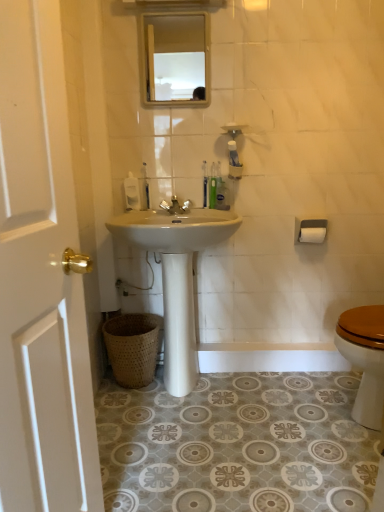
Where is `white matte toilet paper at right`? The height and width of the screenshot is (512, 384). white matte toilet paper at right is located at coordinates (312, 234).

The width and height of the screenshot is (384, 512). Describe the element at coordinates (175, 58) in the screenshot. I see `clear glass mirror at upper center` at that location.

Measure the distance between green plastic toothbrush at upper center, placed as the 1th toothbrush when sorted from right to left, and camera.

The depth of green plastic toothbrush at upper center, placed as the 1th toothbrush when sorted from right to left, is 6.64 feet.

At what (x,y) coordinates should I click in order to perform the action: click on translucent plastic toothbrush at center, which appears as the 2th toothbrush when viewed from the right. Please return your answer as a coordinate pair (x, y). Image resolution: width=384 pixels, height=512 pixels. Looking at the image, I should click on (205, 185).

Based on the photo, is translucent plastic toothbrush at center, which appears as the 2th toothbrush when viewed from the right, to the left of translucent plastic toothbrushes at upper center, the 1th toiletries positioned from the right, from the viewer's perspective?

Indeed, translucent plastic toothbrush at center, which appears as the 2th toothbrush when viewed from the right, is positioned on the left side of translucent plastic toothbrushes at upper center, the 1th toiletries positioned from the right.

Is translucent plastic toothbrushes at upper center, the 1th toiletries positioned from the right, completely or partially inside translucent plastic toothbrush at center, the 2th toothbrush viewed from the left?

That's incorrect, translucent plastic toothbrushes at upper center, the 1th toiletries positioned from the right, is not inside translucent plastic toothbrush at center, the 2th toothbrush viewed from the left.

Is translucent plastic toothbrush at center, the 2th toothbrush viewed from the left, wider or thinner than translucent plastic toothbrushes at upper center, the 1th toiletries positioned from the right?

Clearly, translucent plastic toothbrush at center, the 2th toothbrush viewed from the left, has less width compared to translucent plastic toothbrushes at upper center, the 1th toiletries positioned from the right.

From the image's perspective, between translucent plastic toothbrush at center, which appears as the 2th toothbrush when viewed from the right, and translucent plastic toothbrushes at upper center, the 2th toiletries from the left, which one is located above?

translucent plastic toothbrush at center, which appears as the 2th toothbrush when viewed from the right, from the image's perspective.

Is translucent plastic toothbrushes at upper center, the 1th toiletries positioned from the right, next to translucent plastic toothbrush at center, which appears as the 2th toothbrush when viewed from the right?

Yes, the surface of translucent plastic toothbrushes at upper center, the 1th toiletries positioned from the right, is in contact with translucent plastic toothbrush at center, which appears as the 2th toothbrush when viewed from the right.

How much distance is there between translucent plastic toothbrushes at upper center, the 2th toiletries from the left, and translucent plastic toothbrush at center, the 2th toothbrush viewed from the left?

translucent plastic toothbrushes at upper center, the 2th toiletries from the left, is 3.04 inches from translucent plastic toothbrush at center, the 2th toothbrush viewed from the left.

Consider the image. Is translucent plastic toothbrushes at upper center, the 1th toiletries positioned from the right, in front of or behind translucent plastic toothbrush at center, which appears as the 2th toothbrush when viewed from the right, in the image?

In the image, translucent plastic toothbrushes at upper center, the 1th toiletries positioned from the right, appears in front of translucent plastic toothbrush at center, which appears as the 2th toothbrush when viewed from the right.

From the image's perspective, between translucent plastic toothbrushes at upper center, the 2th toiletries from the left, and translucent plastic toothbrush at center, the 2th toothbrush viewed from the left, who is located below?

translucent plastic toothbrushes at upper center, the 2th toiletries from the left, is shown below in the image.

In the scene shown: Which object is positioned more to the left, translucent plastic toothbrush at center, the 2th toothbrush viewed from the left, or translucent plastic toothbrush at center, which appears as the 1th toothbrush when viewed from the left?

Positioned to the left is translucent plastic toothbrush at center, which appears as the 1th toothbrush when viewed from the left.

Is translucent plastic toothbrush at center, the 2th toothbrush viewed from the left, shorter than translucent plastic toothbrush at center, which appears as the 1th toothbrush when viewed from the left?

In fact, translucent plastic toothbrush at center, the 2th toothbrush viewed from the left, may be taller than translucent plastic toothbrush at center, which appears as the 1th toothbrush when viewed from the left.

From the image's perspective, between translucent plastic toothbrush at center, the 2th toothbrush viewed from the left, and translucent plastic toothbrush at center, placed as the 3th toothbrush when sorted from right to left, which one is located above?

From the image's view, translucent plastic toothbrush at center, the 2th toothbrush viewed from the left, is above.

Considering the positions of points (207, 199) and (147, 183), is point (207, 199) farther from camera compared to point (147, 183)?

That is False.

Considering the sizes of objects translucent plastic soap dispenser at upper center, which is the 2th toiletries in right-to-left order, and white glossy sink at center in the image provided, who is smaller, translucent plastic soap dispenser at upper center, which is the 2th toiletries in right-to-left order, or white glossy sink at center?

translucent plastic soap dispenser at upper center, which is the 2th toiletries in right-to-left order.

Between translucent plastic soap dispenser at upper center, the 1th toiletries viewed from the left, and white glossy sink at center, which one has larger width?

With larger width is white glossy sink at center.

Considering the positions of objects translucent plastic soap dispenser at upper center, the 1th toiletries viewed from the left, and white glossy sink at center in the image provided, who is in front, translucent plastic soap dispenser at upper center, the 1th toiletries viewed from the left, or white glossy sink at center?

white glossy sink at center is closer to the camera.

Could white glossy sink at center be considered to be inside translucent plastic soap dispenser at upper center, the 1th toiletries viewed from the left?

No, white glossy sink at center is located outside of translucent plastic soap dispenser at upper center, the 1th toiletries viewed from the left.

From a real-world perspective, is translucent plastic toothbrush at center, placed as the 3th toothbrush when sorted from right to left, under translucent plastic soap dispenser at upper center, which is the 2th toiletries in right-to-left order?

No, from a real-world perspective, translucent plastic toothbrush at center, placed as the 3th toothbrush when sorted from right to left, is not below translucent plastic soap dispenser at upper center, which is the 2th toiletries in right-to-left order.

Does translucent plastic toothbrush at center, which appears as the 1th toothbrush when viewed from the left, turn towards translucent plastic soap dispenser at upper center, which is the 2th toiletries in right-to-left order?

No, translucent plastic toothbrush at center, which appears as the 1th toothbrush when viewed from the left, is not facing towards translucent plastic soap dispenser at upper center, which is the 2th toiletries in right-to-left order.

Considering the sizes of objects translucent plastic toothbrush at center, which appears as the 1th toothbrush when viewed from the left, and translucent plastic soap dispenser at upper center, the 1th toiletries viewed from the left, in the image provided, who is thinner, translucent plastic toothbrush at center, which appears as the 1th toothbrush when viewed from the left, or translucent plastic soap dispenser at upper center, the 1th toiletries viewed from the left,?

Thinner between the two is translucent plastic toothbrush at center, which appears as the 1th toothbrush when viewed from the left.

In the scene shown: Is translucent plastic toothbrushes at upper center, the 1th toiletries positioned from the right, to the left of translucent plastic soap dispenser at upper center, the 1th toiletries viewed from the left, from the viewer's perspective?

In fact, translucent plastic toothbrushes at upper center, the 1th toiletries positioned from the right, is to the right of translucent plastic soap dispenser at upper center, the 1th toiletries viewed from the left.

Is translucent plastic toothbrushes at upper center, the 2th toiletries from the left, not near translucent plastic soap dispenser at upper center, the 1th toiletries viewed from the left?

No, there isn't a large distance between translucent plastic toothbrushes at upper center, the 2th toiletries from the left, and translucent plastic soap dispenser at upper center, the 1th toiletries viewed from the left.

How different are the orientations of translucent plastic toothbrushes at upper center, the 1th toiletries positioned from the right, and translucent plastic soap dispenser at upper center, the 1th toiletries viewed from the left, in degrees?

They differ by 48.4 degrees in their facing directions.

Considering the sizes of objects silver metallic faucet at center and green plastic toothbrush at upper center, the third toothbrush in the left-to-right sequence, in the image provided, who is smaller, silver metallic faucet at center or green plastic toothbrush at upper center, the third toothbrush in the left-to-right sequence,?

green plastic toothbrush at upper center, the third toothbrush in the left-to-right sequence.

Considering the positions of points (177, 202) and (212, 163), is point (177, 202) farther from camera compared to point (212, 163)?

Yes, it is behind point (212, 163).

How different are the orientations of silver metallic faucet at center and green plastic toothbrush at upper center, the third toothbrush in the left-to-right sequence, in degrees?

3.49 degrees.

Locate an element on the screen. This screenshot has width=384, height=512. the 2nd toiletries below when counting from the translucent plastic toothbrush at center, which appears as the 2th toothbrush when viewed from the right (from the image's perspective) is located at coordinates click(222, 195).

Locate an element on the screen. Image resolution: width=384 pixels, height=512 pixels. toiletries on the right of translucent plastic toothbrush at center, the 2th toothbrush viewed from the left is located at coordinates (222, 195).

Estimate the real-world distances between objects in this image. Which object is further from translucent plastic soap dispenser at upper center, the 1th toiletries viewed from the left, white glossy sink at center or brown woven basket at lower left?

brown woven basket at lower left is further to translucent plastic soap dispenser at upper center, the 1th toiletries viewed from the left.

Which object lies further to the anchor point translucent plastic toothbrush at center, placed as the 3th toothbrush when sorted from right to left, white matte toilet paper at right or green plastic toothbrush at upper center, placed as the 1th toothbrush when sorted from right to left?

Among the two, white matte toilet paper at right is located further to translucent plastic toothbrush at center, placed as the 3th toothbrush when sorted from right to left.

Based on their spatial positions, is green plastic toothbrush at upper center, the third toothbrush in the left-to-right sequence, or white wood door at left further from brown woven basket at lower left?

white wood door at left is further to brown woven basket at lower left.

Which object lies nearer to the anchor point translucent plastic toothbrushes at upper center, the 1th toiletries positioned from the right, translucent plastic soap dispenser at upper center, the 1th toiletries viewed from the left, or translucent plastic toothbrush at center, the 2th toothbrush viewed from the left?

Among the two, translucent plastic toothbrush at center, the 2th toothbrush viewed from the left, is located nearer to translucent plastic toothbrushes at upper center, the 1th toiletries positioned from the right.

From the picture: From the image, which object appears to be nearer to translucent plastic toothbrushes at upper center, the 2th toiletries from the left, translucent plastic toothbrush at center, the 2th toothbrush viewed from the left, or translucent plastic soap dispenser at upper center, the 1th toiletries viewed from the left?

Among the two, translucent plastic toothbrush at center, the 2th toothbrush viewed from the left, is located nearer to translucent plastic toothbrushes at upper center, the 2th toiletries from the left.

Estimate the real-world distances between objects in this image. Which object is further from white wood door at left, silver metallic faucet at center or clear glass mirror at upper center?

clear glass mirror at upper center lies further to white wood door at left than the other object.

Based on their spatial positions, is silver metallic faucet at center or clear glass mirror at upper center further from white matte toilet paper at right?

clear glass mirror at upper center lies further to white matte toilet paper at right than the other object.

Based on their spatial positions, is brown woven basket at lower left or translucent plastic toothbrush at center, which appears as the 2th toothbrush when viewed from the right, further from silver metallic faucet at center?

The object further to silver metallic faucet at center is brown woven basket at lower left.

This screenshot has width=384, height=512. I want to click on faucet located between translucent plastic soap dispenser at upper center, the 1th toiletries viewed from the left, and translucent plastic toothbrushes at upper center, the 1th toiletries positioned from the right, in the left-right direction, so click(x=175, y=206).

I want to click on toiletries positioned between white wood door at left and translucent plastic toothbrush at center, which appears as the 2th toothbrush when viewed from the right, from near to far, so click(x=222, y=195).

In order to click on toiletries between white wood door at left and translucent plastic soap dispenser at upper center, which is the 2th toiletries in right-to-left order, along the z-axis in this screenshot , I will do `click(222, 195)`.

Identify the location of faucet between white wood door at left and green plastic toothbrush at upper center, placed as the 1th toothbrush when sorted from right to left, in the front-back direction. This screenshot has height=512, width=384. (175, 206).